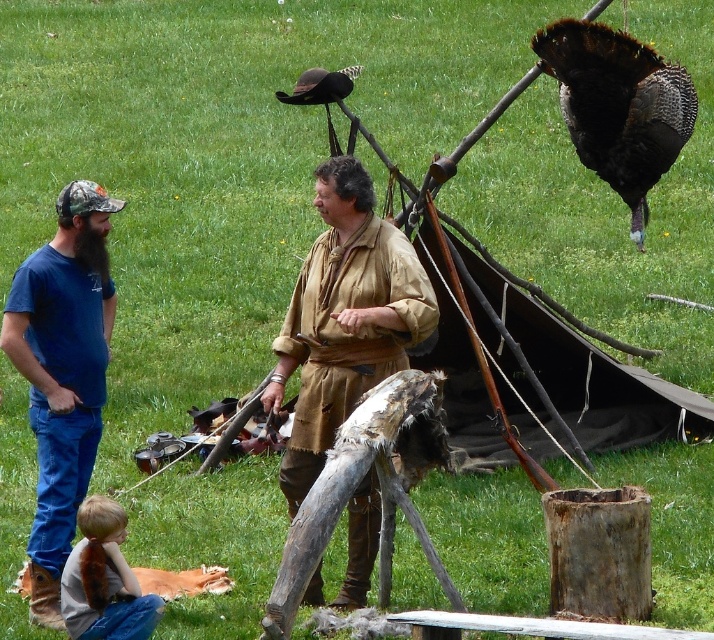
Question: Which object is closer to the camera taking this photo?

Choices:
 (A) shiny black turkey at upper right
 (B) light brown hair at lower left
 (C) brown leather shirt at center
 (D) blue denim jeans at left

Answer: (B)

Question: Which of these objects is positioned closest to the shiny black turkey at upper right?

Choices:
 (A) light brown hair at lower left
 (B) blue denim jeans at left
 (C) brown leather shirt at center

Answer: (C)

Question: Which point is farther to the camera?

Choices:
 (A) (605, 116)
 (B) (368, 582)
 (C) (150, 596)
 (D) (96, 385)

Answer: (A)

Question: Does brown leather shirt at center have a lesser width compared to shiny black turkey at upper right?

Choices:
 (A) yes
 (B) no

Answer: (A)

Question: Does brown leather shirt at center have a smaller size compared to blue denim jeans at left?

Choices:
 (A) no
 (B) yes

Answer: (A)

Question: Is blue denim jeans at left positioned in front of light brown hair at lower left?

Choices:
 (A) yes
 (B) no

Answer: (B)